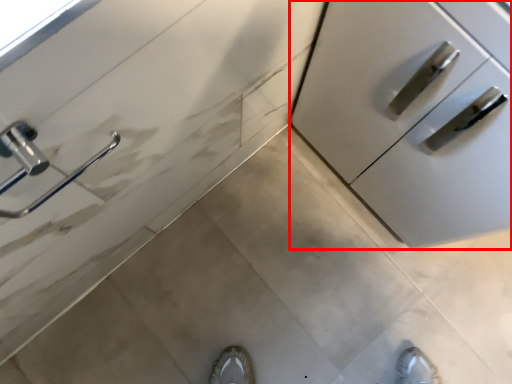
Question: From the image, what is the correct spatial relationship of cabinetry (annotated by the red box) in relation to door handle?

Choices:
 (A) left
 (B) right

Answer: (B)